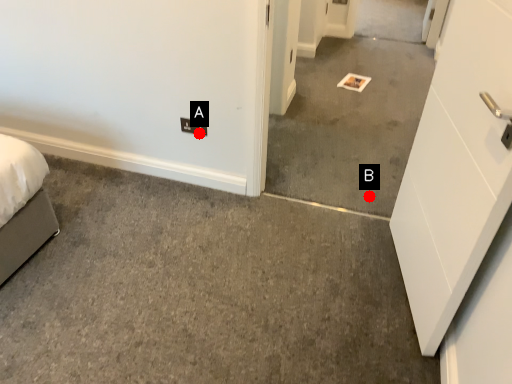
Question: Two points are circled on the image, labeled by A and B beside each circle. Which point appears closest to the camera in this image?

Choices:
 (A) A is closer
 (B) B is closer

Answer: (A)